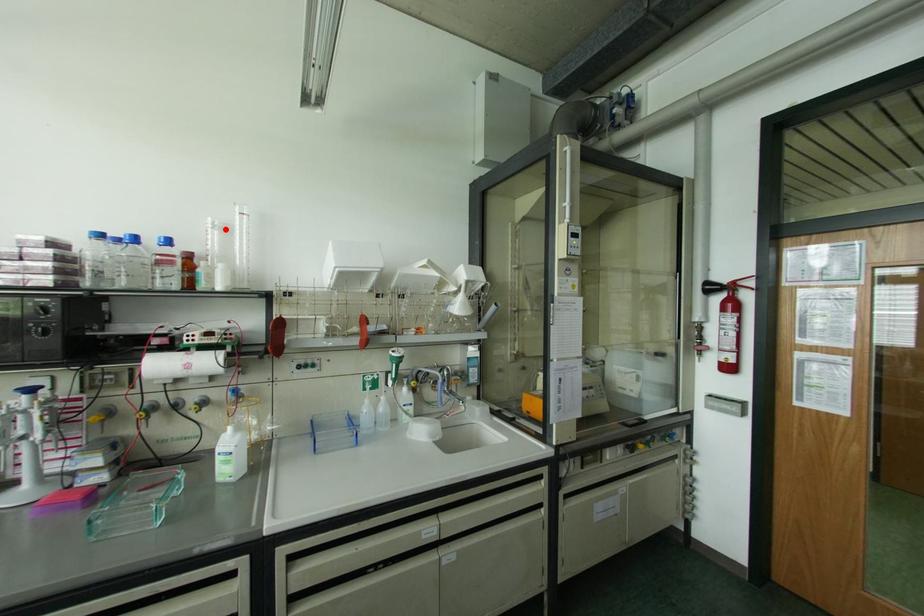
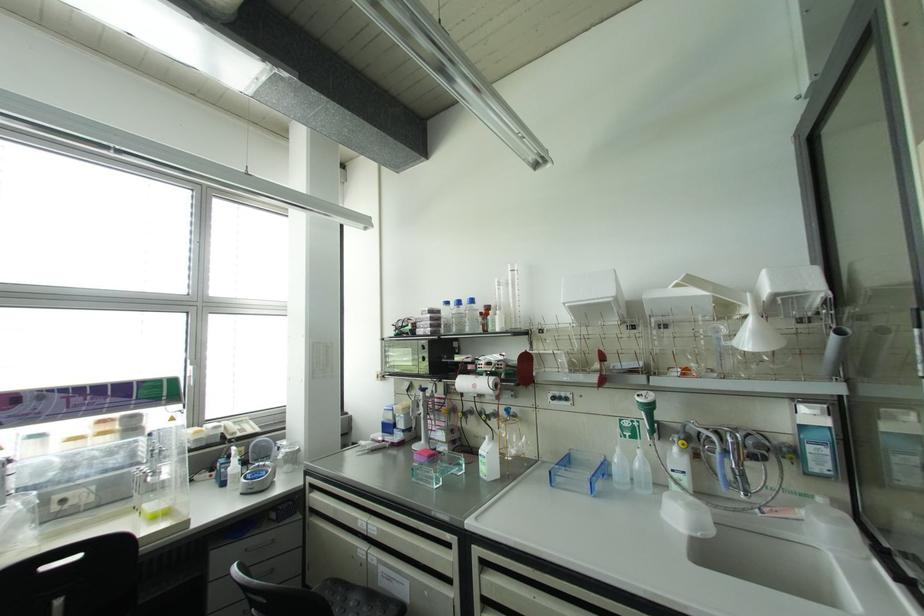
Locate, in the second image, the point that corresponds to the highlighted location in the first image.

(506, 284)